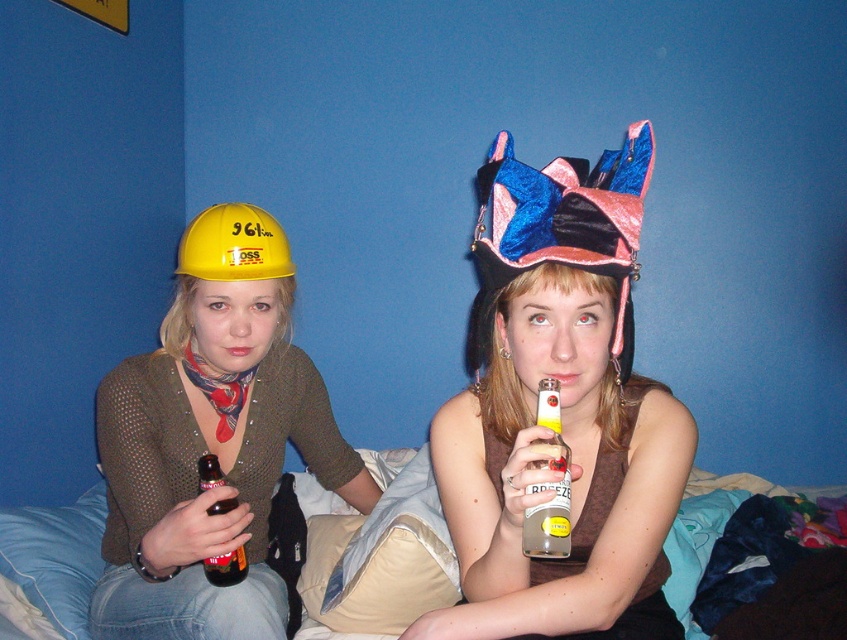
Question: Estimate the real-world distances between objects in this image. Which object is farther from the shiny blue fabric hat at center?

Choices:
 (A) clear glass bottle at center
 (B) brown glass bottle at center
 (C) matte yellow hard hat at left

Answer: (B)

Question: Is velvet pink and blue hat at center positioned behind clear glass bottle at center?

Choices:
 (A) yes
 (B) no

Answer: (A)

Question: Is velvet pink and blue hat at center to the right of brown glass bottle at center from the viewer's perspective?

Choices:
 (A) yes
 (B) no

Answer: (A)

Question: Which of the following is the closest to the observer?

Choices:
 (A) yellow hard hat at left
 (B) velvet pink and blue hat at center
 (C) brown glass bottle at center

Answer: (B)

Question: Which point is closer to the camera taking this photo?

Choices:
 (A) (203, 477)
 (B) (535, 624)
 (C) (277, 228)

Answer: (B)

Question: Is matte yellow hard hat at left further to camera compared to yellow hard hat at left?

Choices:
 (A) yes
 (B) no

Answer: (B)